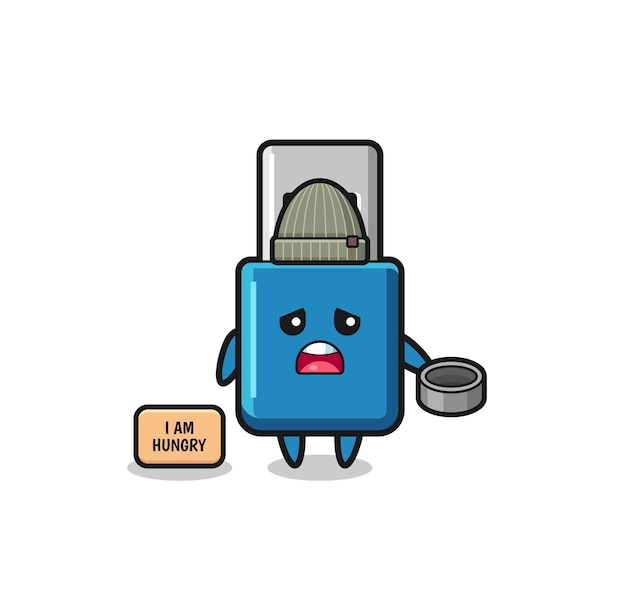
You are a GUI agent. You are given a task and a screenshot of the screen. Output one action in this format:
    pyautogui.click(x=<x>, y=<y>)
    Task: Click on the bowl
    The height and width of the screenshot is (595, 626).
    Given the screenshot: What is the action you would take?
    pyautogui.click(x=464, y=396)